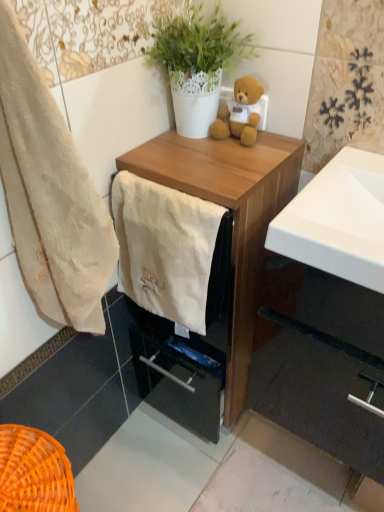
Locate an element on the screen. vacant space in front of soft plush teddy bear at upper center is located at coordinates (228, 168).